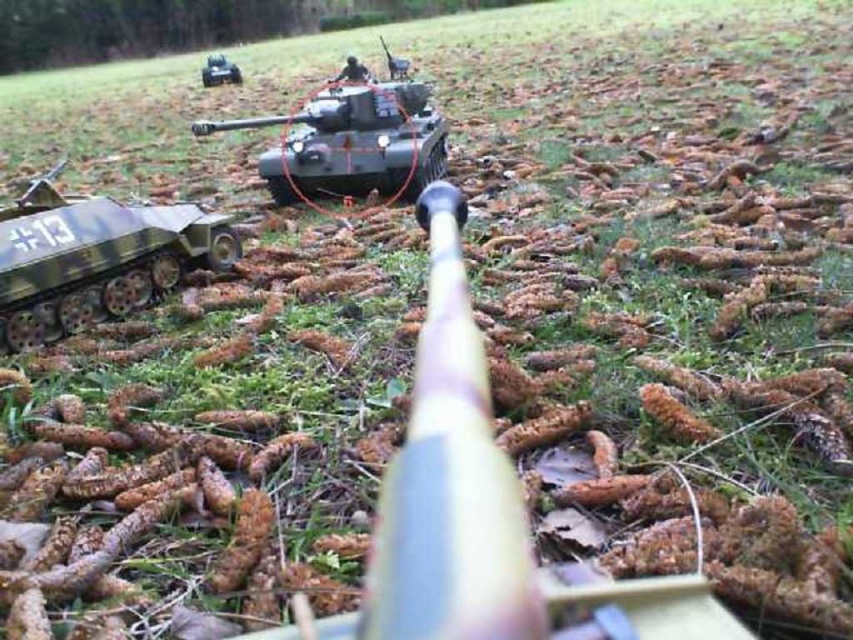
Question: Among these objects, which one is nearest to the camera?

Choices:
 (A) green matte tank at center
 (B) metallic gray tank at upper center

Answer: (A)

Question: Does green matte tank at center have a larger size compared to metallic gray tank at upper center?

Choices:
 (A) yes
 (B) no

Answer: (B)

Question: Is camouflage painted tank at left further to camera compared to metallic gray tank at upper center?

Choices:
 (A) no
 (B) yes

Answer: (A)

Question: Which point is closer to the camera taking this photo?

Choices:
 (A) (224, 74)
 (B) (149, 256)

Answer: (B)

Question: Among these points, which one is farthest from the camera?

Choices:
 (A) (67, 209)
 (B) (202, 70)
 (C) (230, 122)

Answer: (B)

Question: Can you confirm if green matte tank at center is positioned below metallic gray tank at upper center?

Choices:
 (A) yes
 (B) no

Answer: (A)